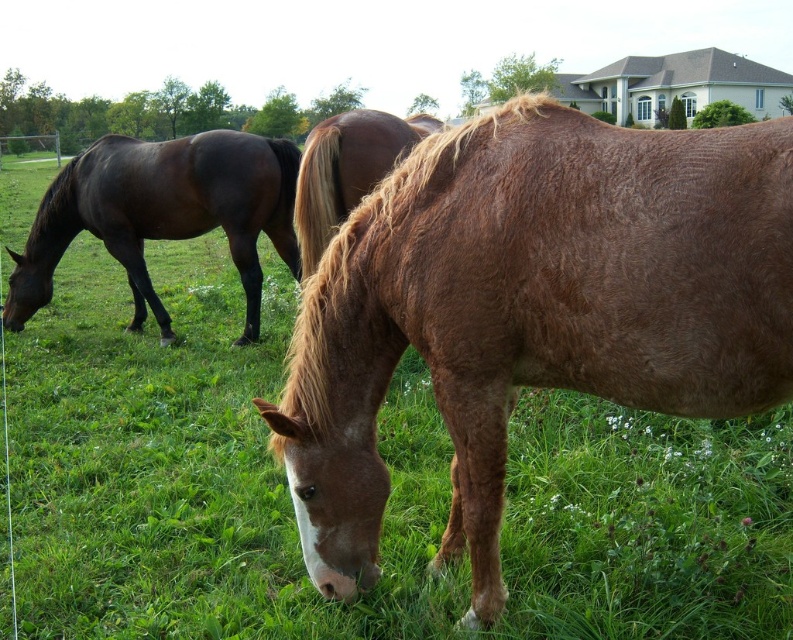
In the scene shown: Can you confirm if shiny dark brown horse at left is smaller than brown shiny horse at center?

No, shiny dark brown horse at left is not smaller than brown shiny horse at center.

Who is positioned more to the left, shiny dark brown horse at left or brown shiny horse at center?

Positioned to the left is shiny dark brown horse at left.

The height and width of the screenshot is (640, 793). Identify the location of shiny dark brown horse at left. (163, 212).

The width and height of the screenshot is (793, 640). I want to click on shiny dark brown horse at left, so click(x=163, y=212).

Is brown fuzzy horse at center taller than shiny dark brown horse at left?

No.

Who is lower down, brown fuzzy horse at center or shiny dark brown horse at left?

brown fuzzy horse at center

Describe the element at coordinates (531, 308) in the screenshot. I see `brown fuzzy horse at center` at that location.

You are a GUI agent. You are given a task and a screenshot of the screen. Output one action in this format:
    pyautogui.click(x=<x>, y=<y>)
    Task: Click on the brown fuzzy horse at center
    This screenshot has width=793, height=640.
    Given the screenshot: What is the action you would take?
    pyautogui.click(x=531, y=308)

Image resolution: width=793 pixels, height=640 pixels. What do you see at coordinates (531, 308) in the screenshot?
I see `brown fuzzy horse at center` at bounding box center [531, 308].

Who is shorter, brown fuzzy horse at center or brown shiny horse at center?

With less height is brown shiny horse at center.

Does point (561, 122) come closer to viewer compared to point (385, 134)?

That is True.

Where is `brown fuzzy horse at center`? brown fuzzy horse at center is located at coordinates pos(531,308).